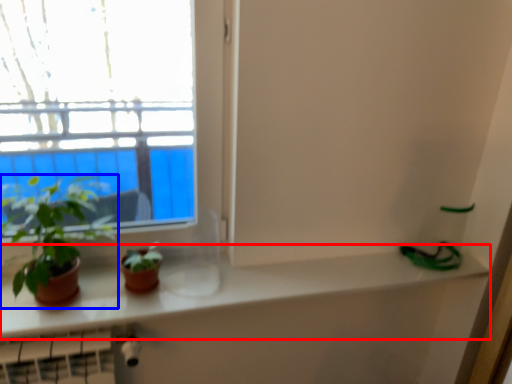
Question: Which point is further to the camera, counter top (highlighted by a red box) or houseplant (highlighted by a blue box)?

Choices:
 (A) counter top
 (B) houseplant

Answer: (A)